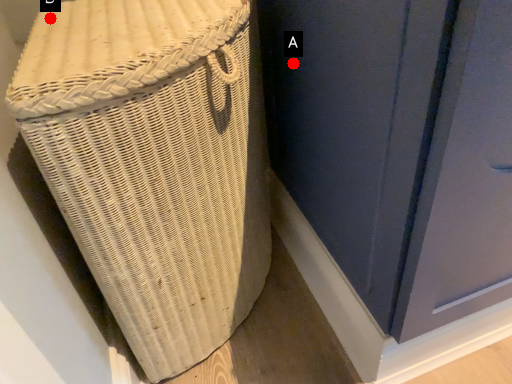
Question: Two points are circled on the image, labeled by A and B beside each circle. Which of the following is the closest to the observer?

Choices:
 (A) A is closer
 (B) B is closer

Answer: (B)